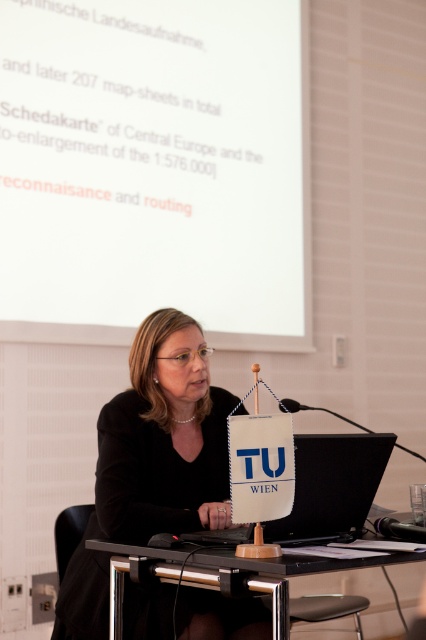
Who is more distant from viewer, (164,8) or (281,602)?

Point (164,8)

Does white matte projection screen at upper center appear under black glass table at center?

No, white matte projection screen at upper center is not below black glass table at center.

Where is `white matte projection screen at upper center`? The height and width of the screenshot is (640, 426). white matte projection screen at upper center is located at coordinates (155, 168).

Which is in front, point (284, 516) or point (161, 554)?

Point (284, 516) is more forward.

Who is higher up, black matte laptop at center or black glass table at center?

black matte laptop at center is higher up.

Is point (232, 544) positioned after point (114, 595)?

No, it is not.

Identify the location of black matte laptop at center. This screenshot has height=640, width=426. (331, 486).

Can you confirm if black matte jacket at center is wider than black matte laptop at center?

Correct, the width of black matte jacket at center exceeds that of black matte laptop at center.

Does black matte jacket at center lie in front of black matte laptop at center?

No.

Between point (166, 605) and point (360, 433), which one is positioned behind?

Positioned behind is point (166, 605).

You are a GUI agent. You are given a task and a screenshot of the screen. Output one action in this format:
    pyautogui.click(x=<x>, y=<y>)
    Task: Click on the black matte jacket at center
    
    Given the screenshot: What is the action you would take?
    pyautogui.click(x=163, y=440)